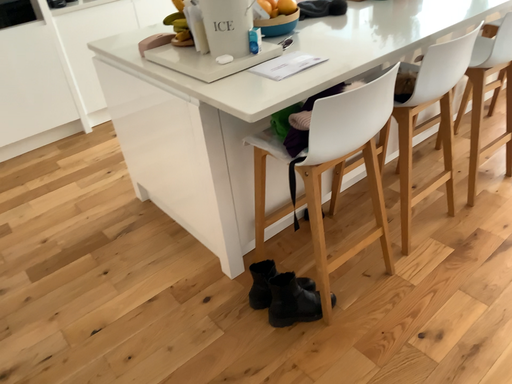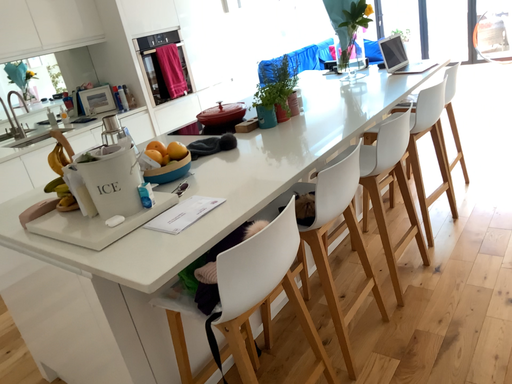
Question: Which way did the camera rotate in the video?

Choices:
 (A) rotated downward
 (B) rotated upward

Answer: (B)